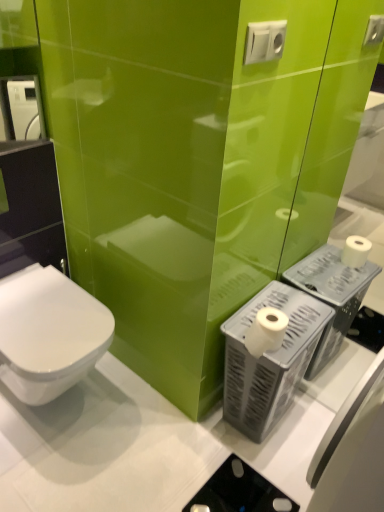
Where is `empty space that is ontop of white glossy toilet at lower left (from a real-world perspective)`? empty space that is ontop of white glossy toilet at lower left (from a real-world perspective) is located at coordinates coord(44,311).